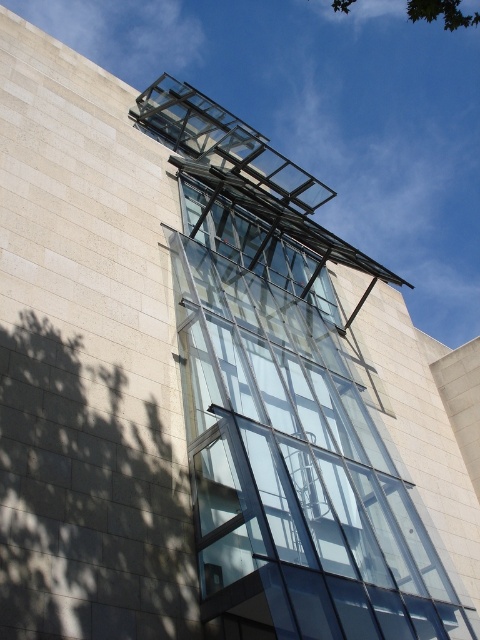
You are an architect reviewing the building design. The transparent glass elevator at center and the green leafy tree at upper center are both visible from the main entrance. Which one appears narrower when viewed from the entrance?

The transparent glass elevator at center appears narrower because it has a lesser width compared to the green leafy tree at upper center.

You are an architect reviewing the building design. You need to determine if the transparent glass elevator at center can be moved to the right side without overlapping the green leafy tree at upper center. Can it fit based on their sizes?

The transparent glass elevator at center occupies less space than the green leafy tree at upper center. Since the elevator is smaller, it can be moved to the right side without overlapping the tree as long as there is enough space on the right side of the building.